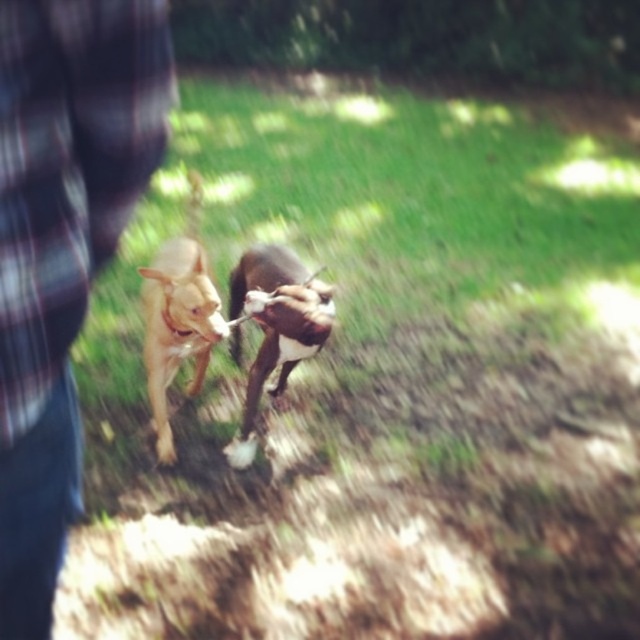
Question: Can you confirm if plaid fabric shirt at left is thinner than brown fur dog at center?

Choices:
 (A) no
 (B) yes

Answer: (B)

Question: Among these objects, which one is nearest to the camera?

Choices:
 (A) plaid fabric shirt at left
 (B) brown fur dog at center
 (C) light brown fur dog at center

Answer: (A)

Question: Which of the following is the farthest from the observer?

Choices:
 (A) (19, 186)
 (B) (196, 240)
 (C) (288, 364)

Answer: (B)

Question: Which object is positioned farthest from the brown fur dog at center?

Choices:
 (A) light brown fur dog at center
 (B) plaid fabric shirt at left

Answer: (B)

Question: Can you confirm if plaid fabric shirt at left is positioned to the left of brown fur dog at center?

Choices:
 (A) no
 (B) yes

Answer: (B)

Question: Does plaid fabric shirt at left have a greater width compared to brown fur dog at center?

Choices:
 (A) yes
 (B) no

Answer: (B)